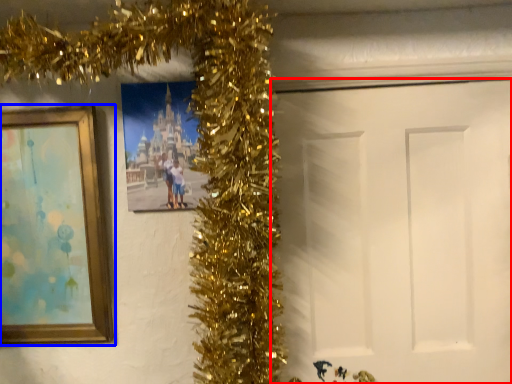
Question: Which of the following is the farthest to the observer, door (highlighted by a red box) or picture frame (highlighted by a blue box)?

Choices:
 (A) door
 (B) picture frame

Answer: (A)